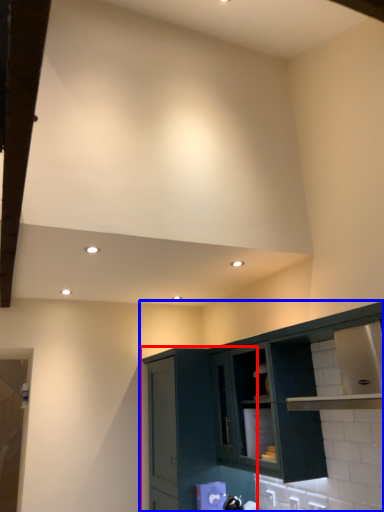
Question: Which object is further to the camera taking this photo, cabinetry (highlighted by a red box) or cabinetry (highlighted by a blue box)?

Choices:
 (A) cabinetry
 (B) cabinetry

Answer: (A)